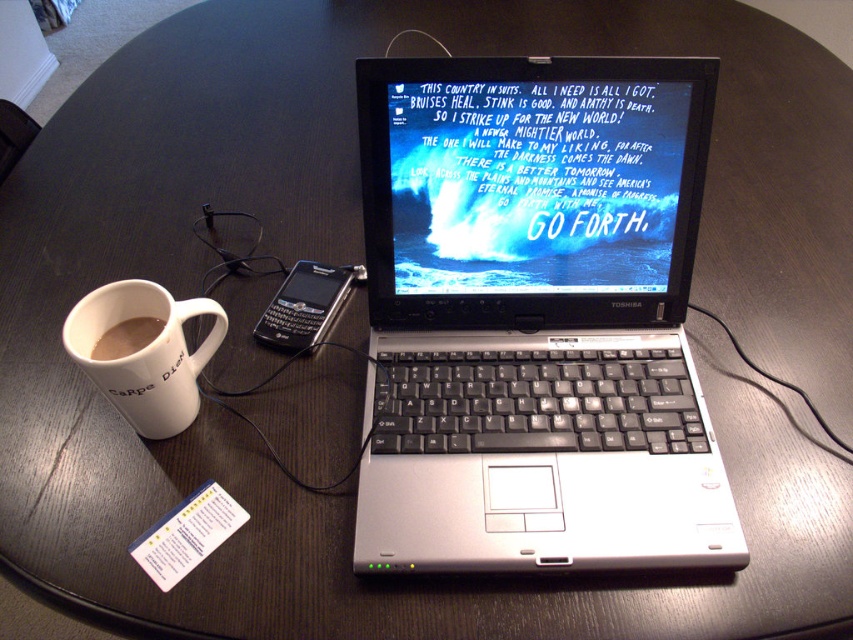
Question: Among these points, which one is farthest from the camera?

Choices:
 (A) (148, 285)
 (B) (521, 300)

Answer: (B)

Question: Is silver/black keyboard at center further to the viewer compared to brown matte mug at left?

Choices:
 (A) yes
 (B) no

Answer: (B)

Question: Which of the following is the farthest from the observer?

Choices:
 (A) brown matte mug at left
 (B) white ceramic mug at left

Answer: (A)

Question: Can you confirm if white ceramic mug at left is bigger than black plastic smartphone at center?

Choices:
 (A) no
 (B) yes

Answer: (B)

Question: Can you confirm if white ceramic mug at left is positioned above brown matte mug at left?

Choices:
 (A) yes
 (B) no

Answer: (A)

Question: Which of the following is the farthest from the observer?

Choices:
 (A) (129, 323)
 (B) (337, 296)
 (C) (511, 140)
 (D) (62, 342)

Answer: (B)